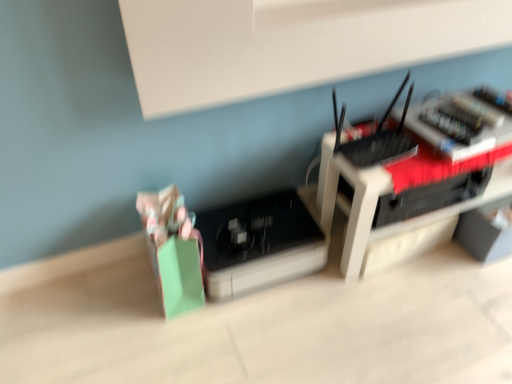
This screenshot has height=384, width=512. In order to click on free space in front of black plastic router at center in this screenshot , I will do `click(436, 310)`.